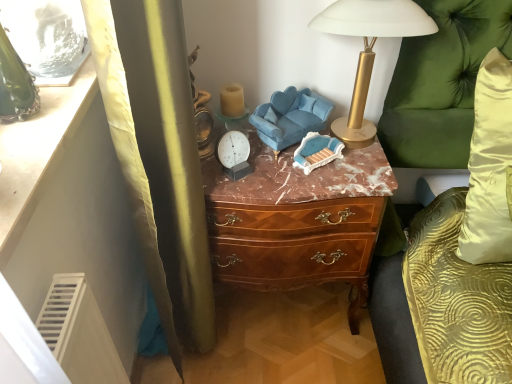
This screenshot has width=512, height=384. What are the coordinates of `free spot above matte white vanity at upper left (from a real-world perspective)` in the screenshot? It's located at (38, 119).